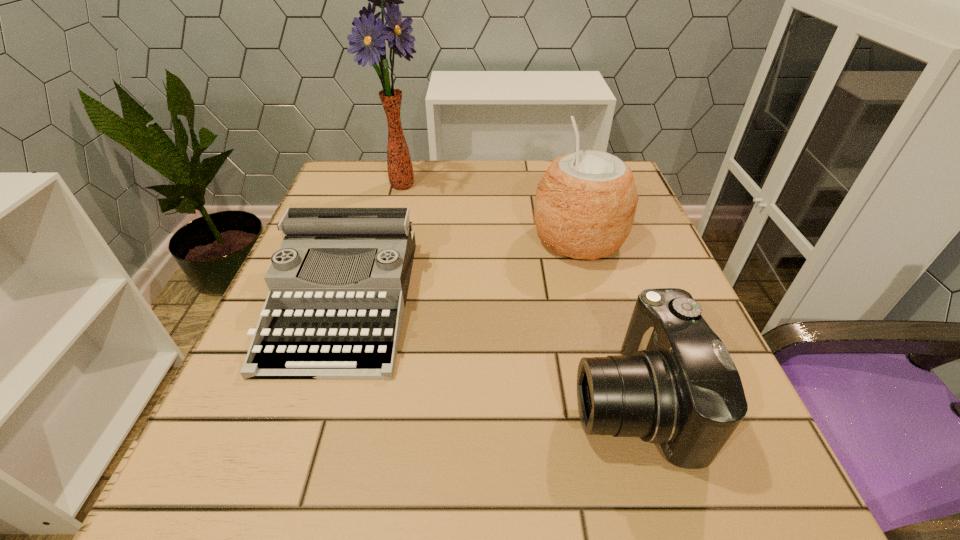
This screenshot has height=540, width=960. I want to click on object that stands as the third closest to the coconut, so click(368, 39).

Image resolution: width=960 pixels, height=540 pixels. What are the coordinates of `free space that satisfies the following two spatial constraints: 1. on the front side of the second tallest object; 2. on the right side of the tallest object` in the screenshot? It's located at (387, 240).